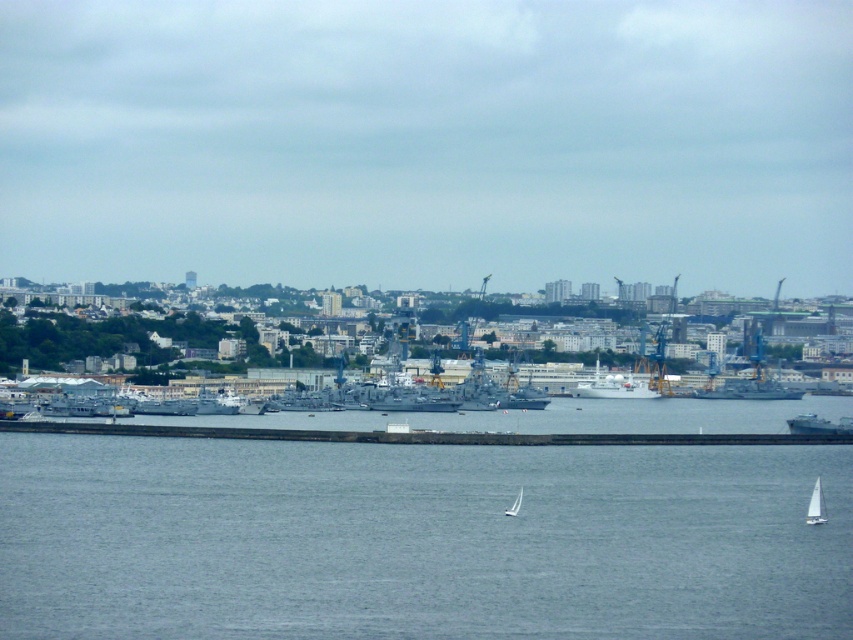
Looking at this image, based on the provided scene description, what object is located at the coordinates point (613, 387)?

The point (613, 387) marks the white matte ship at center.

You are a harbor pilot planning to navigate a new cargo ship into the harbor. You notice the white matte ship at center and the white matte sailboat at center in the water. Based on their sizes, which vessel should you prioritize moving first to ensure safe passage for the cargo ship?

The white matte ship at center should be prioritized because it is larger than the white matte sailboat at center, and moving larger vessels first can help in managing space more effectively for the incoming cargo ship.

You are a photographer standing at the edge of the harbor. You want to capture a photo that emphasizes the height difference between the blue water at lower center and the white matte ship at center. Which object should you focus on to highlight this contrast?

The blue water at lower center is much taller than the white matte ship at center, so focusing on the blue water at lower center will emphasize its greater height compared to the ship.